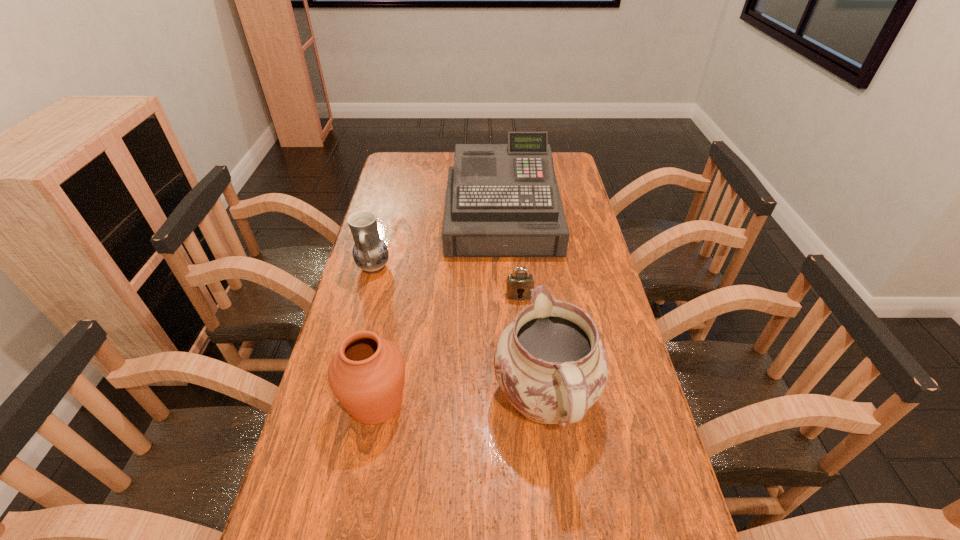
Image resolution: width=960 pixels, height=540 pixels. I want to click on cash register, so click(x=502, y=200).

You are a GUI agent. You are given a task and a screenshot of the screen. Output one action in this format:
    pyautogui.click(x=<x>, y=<y>)
    Task: Click on the pitcher
    This screenshot has width=960, height=540.
    Given the screenshot: What is the action you would take?
    pyautogui.click(x=550, y=363)

You are a GUI agent. You are given a task and a screenshot of the screen. Output one action in this format:
    pyautogui.click(x=<x>, y=<y>)
    Task: Click on the urn
    The image size is (960, 540).
    Given the screenshot: What is the action you would take?
    pyautogui.click(x=367, y=373)

You are a GUI agent. You are given a task and a screenshot of the screen. Output one action in this format:
    pyautogui.click(x=<x>, y=<y>)
    Task: Click on the pottery
    
    Given the screenshot: What is the action you would take?
    pyautogui.click(x=370, y=253)

You are a GUI agent. You are given a task and a screenshot of the screen. Output one action in this format:
    pyautogui.click(x=<x>, y=<y>)
    Task: Click on the third farthest object
    This screenshot has width=960, height=540.
    Given the screenshot: What is the action you would take?
    pyautogui.click(x=518, y=285)

This screenshot has width=960, height=540. I want to click on the shortest object, so (x=518, y=285).

This screenshot has width=960, height=540. I want to click on free space located on the front-facing side of the cash register, so click(506, 269).

Identify the location of vacant space positioned 0.350m on the spout of the pitcher. The image size is (960, 540). (529, 263).

Where is `vacant space located on the spout of the pitcher`? vacant space located on the spout of the pitcher is located at coordinates (536, 315).

I want to click on vacant space located on the spout of the pitcher, so click(x=534, y=302).